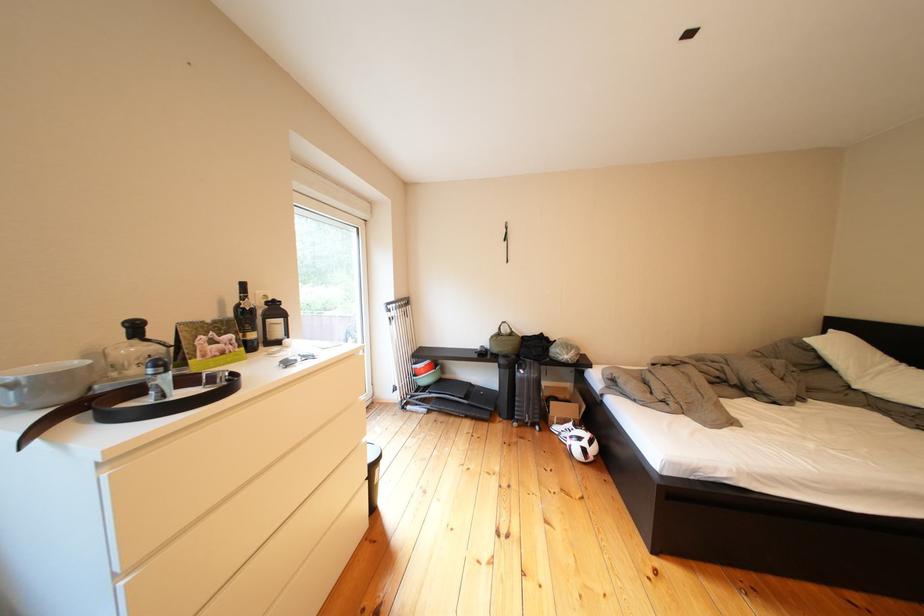
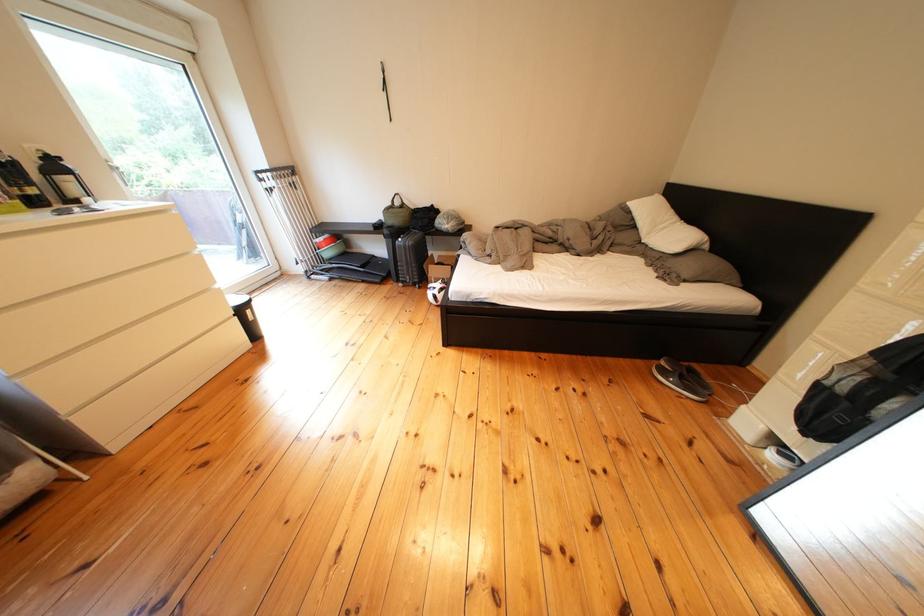
Locate, in the second image, the point that corresponds to point 516,366 in the first image.

(399, 236)